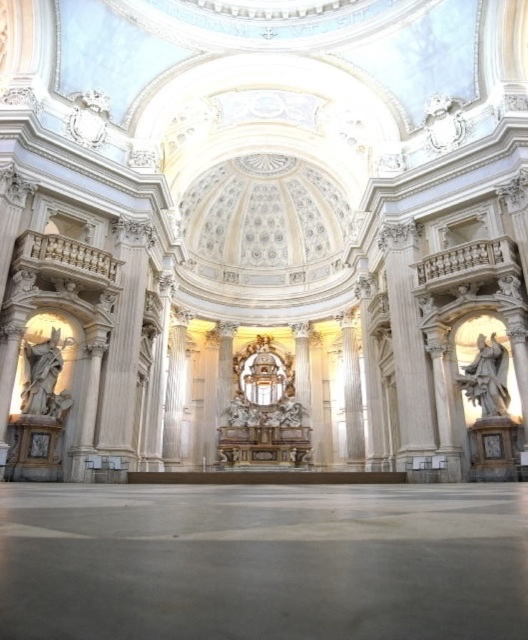
Can you confirm if white marble statue at left is smaller than white marble statue at right?

Actually, white marble statue at left might be larger than white marble statue at right.

Can you confirm if white marble statue at left is thinner than white marble statue at right?

Incorrect, white marble statue at left's width is not less than white marble statue at right's.

The height and width of the screenshot is (640, 528). Describe the element at coordinates (44, 376) in the screenshot. I see `white marble statue at left` at that location.

You are a GUI agent. You are given a task and a screenshot of the screen. Output one action in this format:
    pyautogui.click(x=<x>, y=<y>)
    Task: Click on the white marble statue at left
    
    Given the screenshot: What is the action you would take?
    pyautogui.click(x=44, y=376)